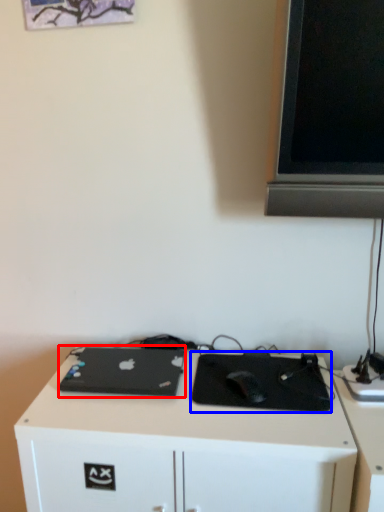
Question: Which point is closer to the camera, laptop (highlighted by a red box) or mousepad (highlighted by a blue box)?

Choices:
 (A) laptop
 (B) mousepad

Answer: (B)